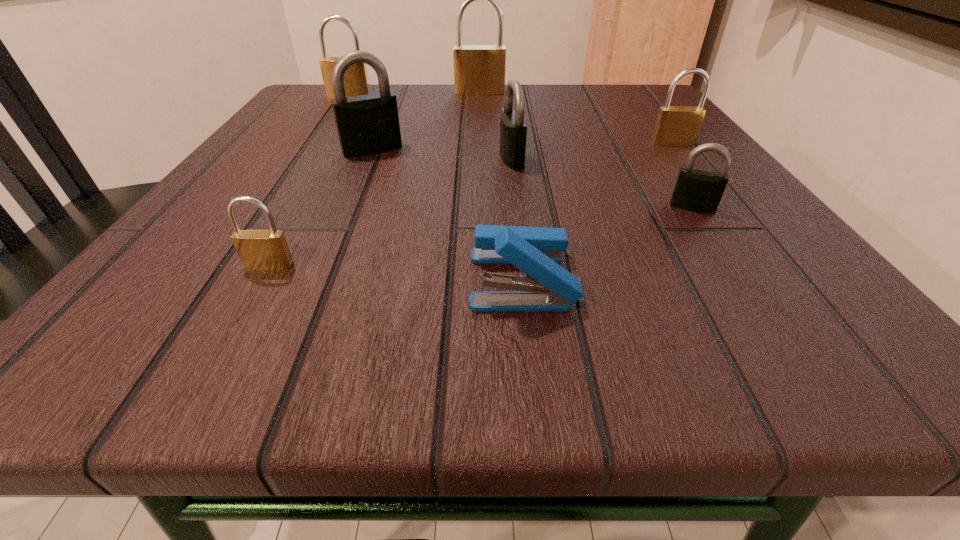
What are the coordinates of `the tallest object` in the screenshot? It's located at (478, 69).

At what (x,y) coordinates should I click in order to perform the action: click on the third brass padlock from left to right. Please return your answer as a coordinate pair (x, y). Image resolution: width=960 pixels, height=540 pixels. Looking at the image, I should click on (478, 69).

The width and height of the screenshot is (960, 540). What are the coordinates of `the second biggest brass padlock` in the screenshot? It's located at (356, 83).

Where is `the biggest black padlock`? the biggest black padlock is located at coordinates (368, 124).

Where is `the second black padlock from left to right`? Image resolution: width=960 pixels, height=540 pixels. the second black padlock from left to right is located at coordinates (513, 130).

At what (x,y) coordinates should I click in order to perform the action: click on the rightmost brass padlock. Please return your answer as a coordinate pair (x, y). Looking at the image, I should click on (676, 125).

This screenshot has width=960, height=540. Identify the location of the second smallest brass padlock. (676, 125).

Locate an element on the screen. This screenshot has height=540, width=960. the sixth farthest padlock is located at coordinates (700, 191).

This screenshot has height=540, width=960. I want to click on the rightmost black padlock, so click(700, 191).

Identify the location of the nearest padlock. The height and width of the screenshot is (540, 960). (266, 250).